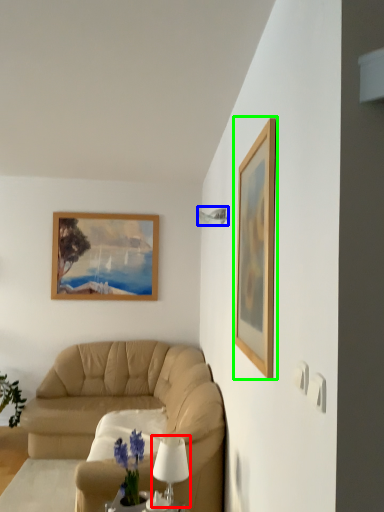
Question: Which object is positioned closest to table lamp (highlighted by a red box)? Select from lamp (highlighted by a blue box) and picture frame (highlighted by a green box).

Choices:
 (A) lamp
 (B) picture frame

Answer: (B)